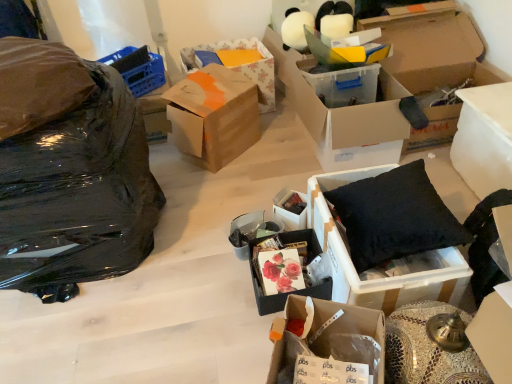
Question: From the image's perspective, is cardboard box at center, which is the 5th box in left-to-right order, above black plastic bag at left?

Choices:
 (A) no
 (B) yes

Answer: (A)

Question: From a real-world perspective, is cardboard box at center, the 5th box in the right-to-left sequence, over black plastic bag at left?

Choices:
 (A) no
 (B) yes

Answer: (A)

Question: Considering the relative sizes of cardboard box at center, which is the 5th box in left-to-right order, and black plastic bag at left in the image provided, is cardboard box at center, which is the 5th box in left-to-right order, thinner than black plastic bag at left?

Choices:
 (A) no
 (B) yes

Answer: (B)

Question: From a real-world perspective, is cardboard box at center, which is the 5th box in left-to-right order, positioned under black plastic bag at left based on gravity?

Choices:
 (A) no
 (B) yes

Answer: (B)

Question: Is cardboard box at center, the 5th box in the right-to-left sequence, aimed at black plastic bag at left?

Choices:
 (A) no
 (B) yes

Answer: (B)

Question: From the image's perspective, is cardboard box at center, the 5th box in the right-to-left sequence, under black plastic bag at left?

Choices:
 (A) no
 (B) yes

Answer: (B)

Question: From a real-world perspective, is matte floral print box at center, acting as the seventh box starting from the right, on cardboard box at upper right, the 8th box from the left?

Choices:
 (A) yes
 (B) no

Answer: (B)

Question: Is matte floral print box at center, the third box in the left-to-right sequence, bigger than cardboard box at upper right, arranged as the second box when viewed from the right?

Choices:
 (A) yes
 (B) no

Answer: (B)

Question: Is matte floral print box at center, acting as the seventh box starting from the right, facing towards cardboard box at upper right, arranged as the second box when viewed from the right?

Choices:
 (A) no
 (B) yes

Answer: (A)

Question: Is matte floral print box at center, the third box in the left-to-right sequence, turned away from cardboard box at upper right, arranged as the second box when viewed from the right?

Choices:
 (A) yes
 (B) no

Answer: (B)

Question: Considering the relative sizes of matte floral print box at center, acting as the seventh box starting from the right, and cardboard box at upper right, arranged as the second box when viewed from the right, in the image provided, is matte floral print box at center, acting as the seventh box starting from the right, smaller than cardboard box at upper right, arranged as the second box when viewed from the right,?

Choices:
 (A) no
 (B) yes

Answer: (B)

Question: Considering the relative sizes of matte floral print box at center, the third box in the left-to-right sequence, and cardboard box at upper right, the 8th box from the left, in the image provided, is matte floral print box at center, the third box in the left-to-right sequence, wider than cardboard box at upper right, the 8th box from the left,?

Choices:
 (A) yes
 (B) no

Answer: (B)

Question: From the image's perspective, would you say transparent plastic box at center, acting as the seventh box starting from the left, is shown under cardboard box at center, the 5th box in the right-to-left sequence?

Choices:
 (A) yes
 (B) no

Answer: (B)